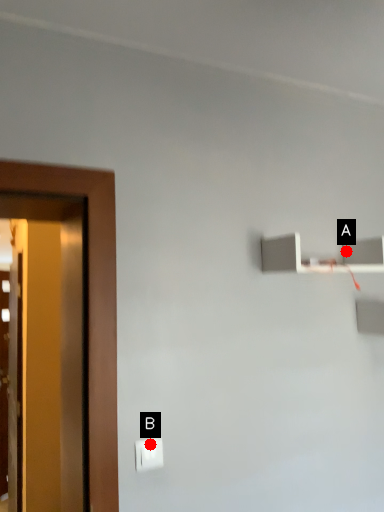
Question: Two points are circled on the image, labeled by A and B beside each circle. Which point appears closest to the camera in this image?

Choices:
 (A) A is closer
 (B) B is closer

Answer: (B)